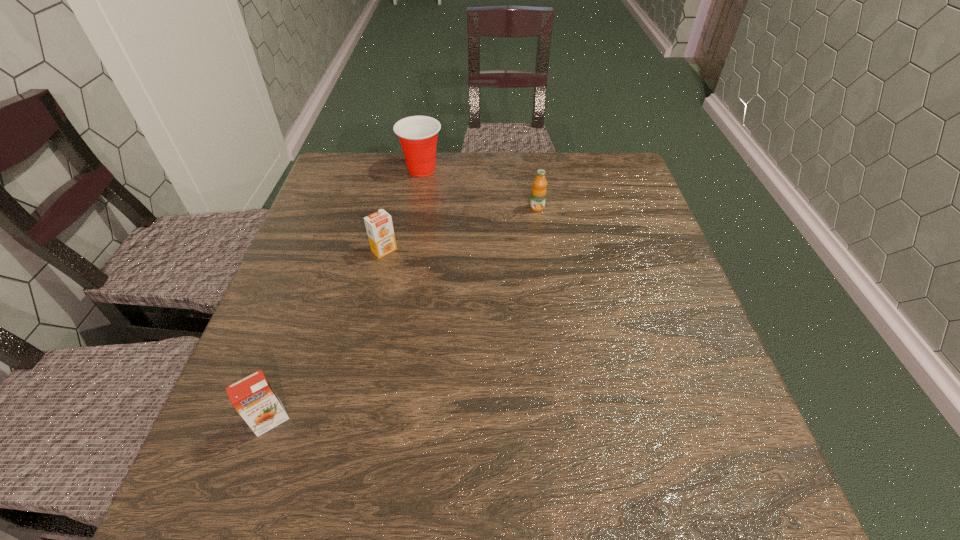
I want to click on the farthest object, so click(418, 135).

Find the location of a particular element. The image size is (960, 540). the tallest object is located at coordinates (x=418, y=135).

Where is `the farthest orange juice`? Image resolution: width=960 pixels, height=540 pixels. the farthest orange juice is located at coordinates [538, 196].

What are the coordinates of `the second farthest object` in the screenshot? It's located at (538, 196).

The image size is (960, 540). What are the coordinates of `the leftmost object` in the screenshot? It's located at (253, 397).

The image size is (960, 540). I want to click on the nearest orange juice, so click(x=253, y=397).

I want to click on the third farthest object, so click(x=379, y=226).

Find the location of a particular element. the second orange juice from left to right is located at coordinates (379, 226).

This screenshot has height=540, width=960. I want to click on free space located on the right of the farthest object, so click(464, 169).

At what (x,y) coordinates should I click in order to perform the action: click on free space located 0.060m on the label of the rightmost object. Please return your answer as a coordinate pair (x, y). This screenshot has width=960, height=540. Looking at the image, I should click on (540, 227).